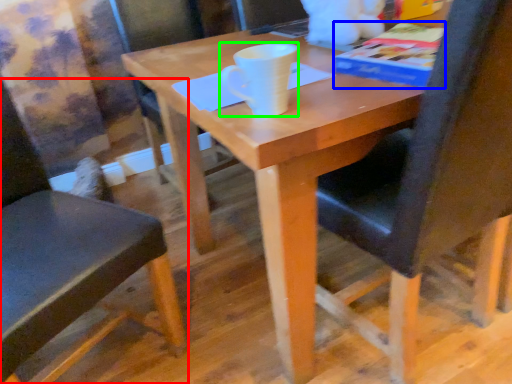
Question: Which object is the farthest from chair (highlighted by a red box)? Choose among these: paperback book (highlighted by a blue box) or coffee cup (highlighted by a green box).

Choices:
 (A) paperback book
 (B) coffee cup

Answer: (A)